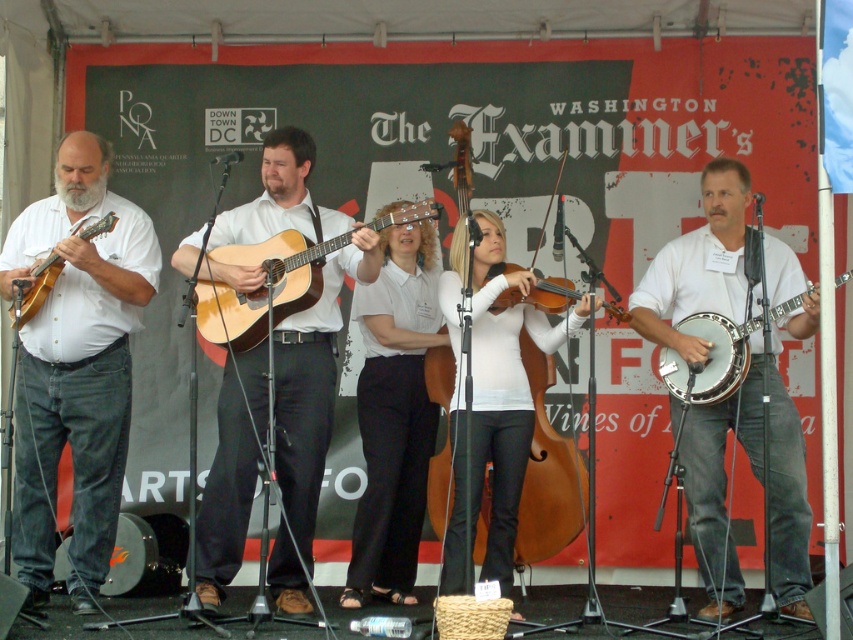
Which is in front, point (386, 595) or point (491, 440)?

Point (491, 440) is in front.

Looking at this image, does white glossy shirt at center have a larger size compared to white matte violin at center?

No.

Identify the location of white glossy shirt at center. This screenshot has height=640, width=853. (393, 413).

Can you confirm if light brown acoustic guitar at center is shorter than matte wood mandolin at left?

No, light brown acoustic guitar at center is not shorter than matte wood mandolin at left.

Which is more to the left, light brown acoustic guitar at center or matte wood mandolin at left?

matte wood mandolin at left

Between point (224, 252) and point (106, 225), which one is positioned in front?

Point (106, 225) is in front.

Locate an element on the screen. The image size is (853, 640). light brown acoustic guitar at center is located at coordinates (262, 288).

Between point (502, 332) and point (305, 252), which one is positioned behind?

Positioned behind is point (502, 332).

Measure the distance between white matte violin at center and camera.

white matte violin at center is 6.11 meters away from camera.

Locate an element on the screen. The width and height of the screenshot is (853, 640). white matte violin at center is located at coordinates (491, 397).